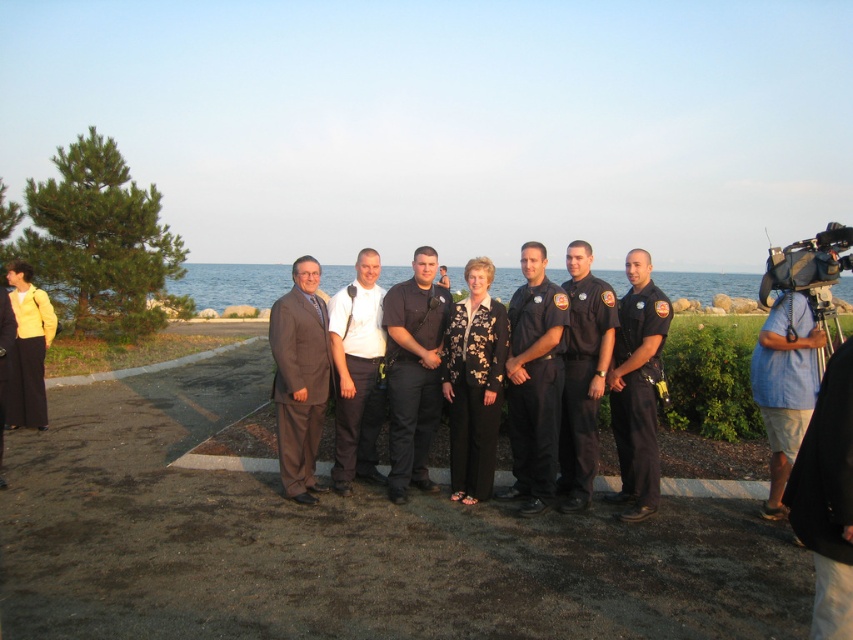
Where is `dark gray uniform at center`? dark gray uniform at center is located at coordinates point(413,371).

Is dark gray uniform at center thinner than dark blue uniform at center?

Incorrect, dark gray uniform at center's width is not less than dark blue uniform at center's.

Between point (416, 410) and point (566, 260), which one is positioned in front?

Positioned in front is point (416, 410).

The height and width of the screenshot is (640, 853). What are the coordinates of `dark gray uniform at center` in the screenshot? It's located at (413, 371).

In order to click on dark gray uniform at center in this screenshot , I will do `click(413, 371)`.

Is dark gray uniform at center positioned at the back of blue shirt at right?

Yes, it is.

Between point (416, 250) and point (810, 400), which one is positioned in front?

Point (810, 400)

The width and height of the screenshot is (853, 640). I want to click on dark gray uniform at center, so 413,371.

Is brown suit at center shorter than white cotton shirt at center?

Correct, brown suit at center is not as tall as white cotton shirt at center.

This screenshot has height=640, width=853. What do you see at coordinates (299, 378) in the screenshot? I see `brown suit at center` at bounding box center [299, 378].

Which is in front, point (296, 348) or point (373, 301)?

Point (296, 348) is in front.

Identify the location of brown suit at center. The image size is (853, 640). tap(299, 378).